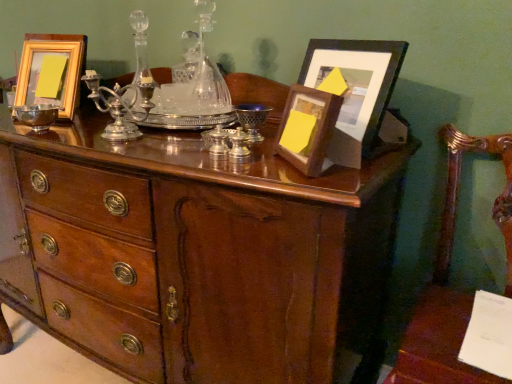
The height and width of the screenshot is (384, 512). Find the location of `free space between shiny silver candle holder at center, which is the third candle holder in back-to-front order, and silver polished candle holder at center, acting as the 3th candle holder starting from the right`. free space between shiny silver candle holder at center, which is the third candle holder in back-to-front order, and silver polished candle holder at center, acting as the 3th candle holder starting from the right is located at coordinates (177, 148).